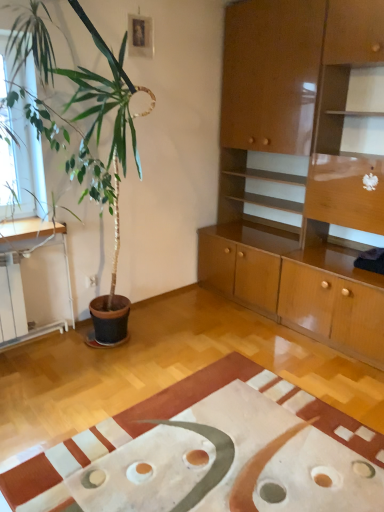
Question: Does glossy wood cabinet at upper right appear on the right side of white matte rug at lower center?

Choices:
 (A) no
 (B) yes

Answer: (B)

Question: Is glossy wood cabinet at upper right positioned with its back to white matte rug at lower center?

Choices:
 (A) no
 (B) yes

Answer: (A)

Question: From the image's perspective, is glossy wood cabinet at upper right on white matte rug at lower center?

Choices:
 (A) no
 (B) yes

Answer: (B)

Question: Are glossy wood cabinet at upper right and white matte rug at lower center beside each other?

Choices:
 (A) no
 (B) yes

Answer: (A)

Question: Can we say glossy wood cabinet at upper right lies outside white matte rug at lower center?

Choices:
 (A) yes
 (B) no

Answer: (A)

Question: Is glossy wood cabinet at upper right not close to white matte rug at lower center?

Choices:
 (A) yes
 (B) no

Answer: (A)

Question: Is glossy wood cabinet at upper right at the back of white matte rug at lower center?

Choices:
 (A) no
 (B) yes

Answer: (A)

Question: Considering the relative positions of white matte rug at lower center and glossy wood cabinet at upper right in the image provided, is white matte rug at lower center behind glossy wood cabinet at upper right?

Choices:
 (A) no
 (B) yes

Answer: (A)

Question: Is white matte rug at lower center wider than glossy wood cabinet at upper right?

Choices:
 (A) yes
 (B) no

Answer: (A)

Question: Are white matte rug at lower center and glossy wood cabinet at upper right beside each other?

Choices:
 (A) no
 (B) yes

Answer: (A)

Question: From the image's perspective, would you say white matte rug at lower center is shown under glossy wood cabinet at upper right?

Choices:
 (A) no
 (B) yes

Answer: (B)

Question: From a real-world perspective, is white matte rug at lower center located beneath glossy wood cabinet at upper right?

Choices:
 (A) no
 (B) yes

Answer: (B)

Question: Considering the positions of glossy wood cabinet at upper right and white matte rug at lower center in the image, is glossy wood cabinet at upper right taller or shorter than white matte rug at lower center?

Choices:
 (A) tall
 (B) short

Answer: (A)